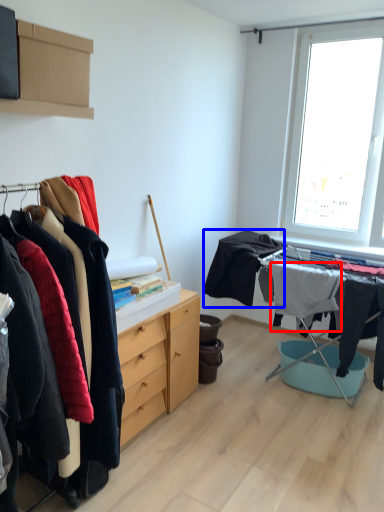
Question: Which object is closer to the camera taking this photo, clothing (highlighted by a red box) or clothing (highlighted by a blue box)?

Choices:
 (A) clothing
 (B) clothing

Answer: (B)